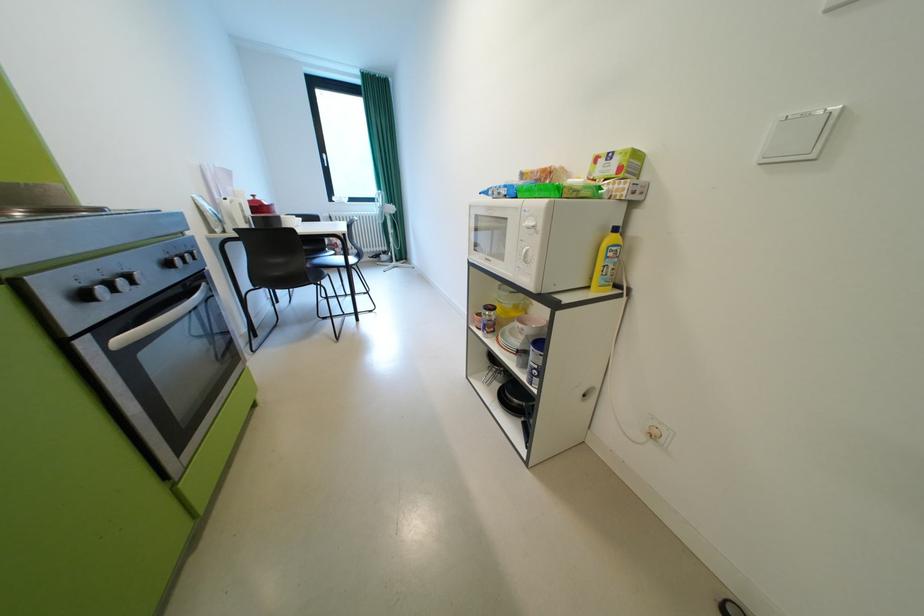
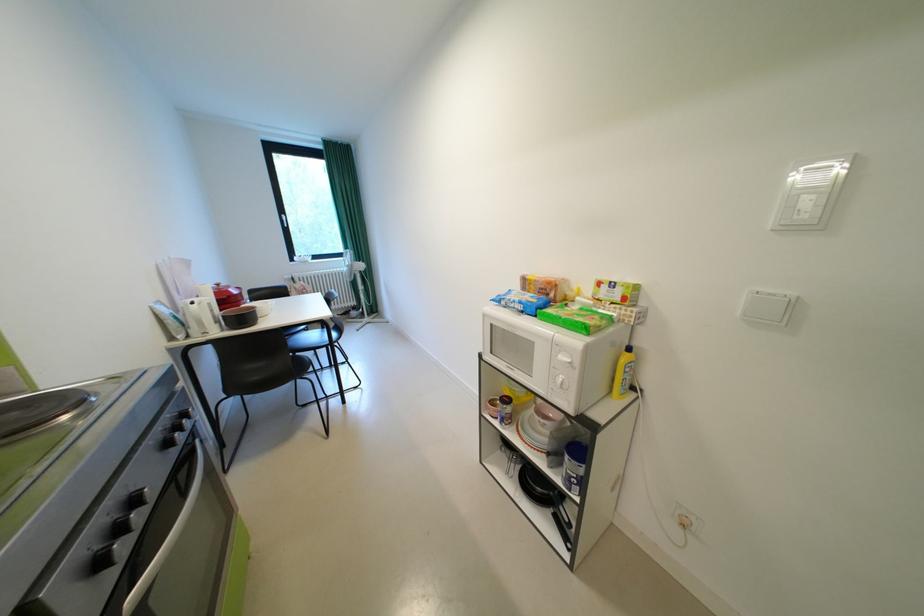
The point at (521,403) is marked in the first image. Where is the corresponding point in the second image?

(544, 490)